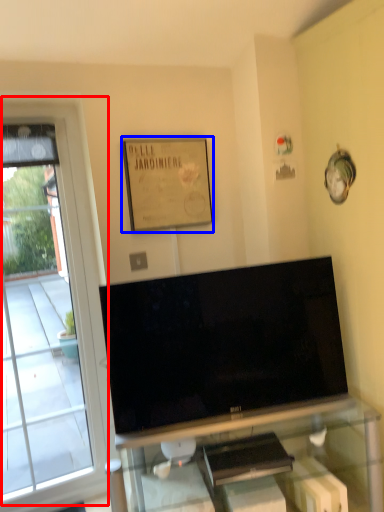
Question: Which of the following is the closest to the observer, window (highlighted by a red box) or picture frame (highlighted by a blue box)?

Choices:
 (A) window
 (B) picture frame

Answer: (A)